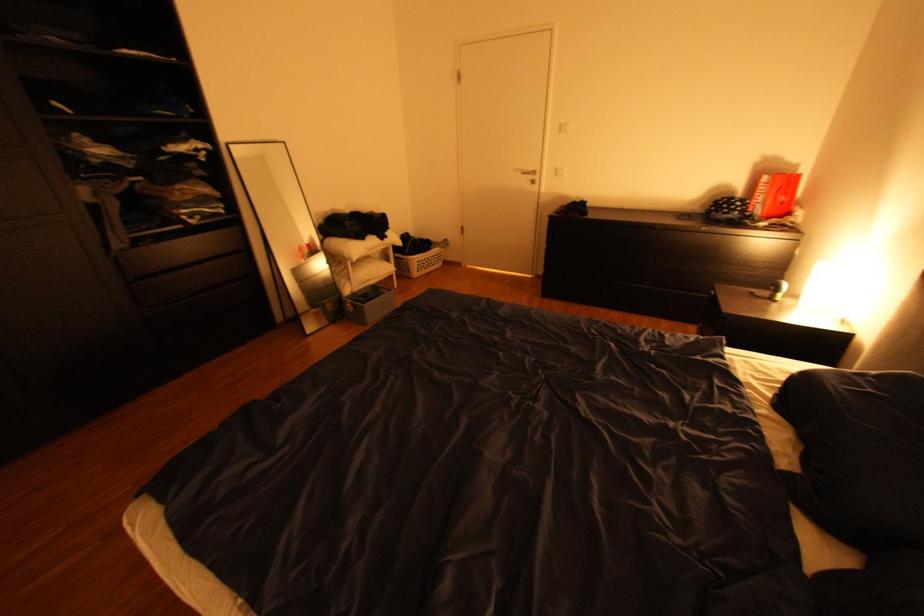
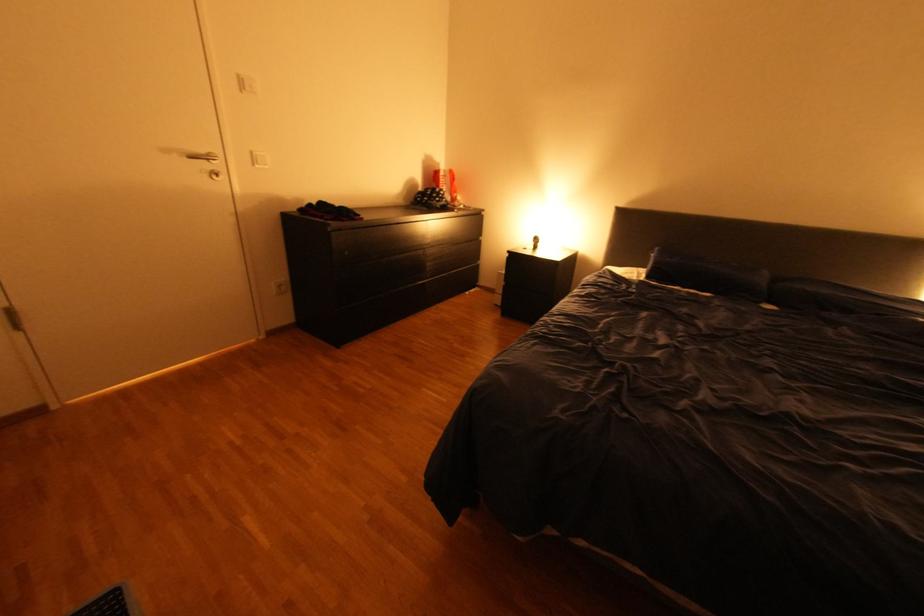
The point at (748, 208) is marked in the first image. Where is the corresponding point in the second image?

(454, 196)